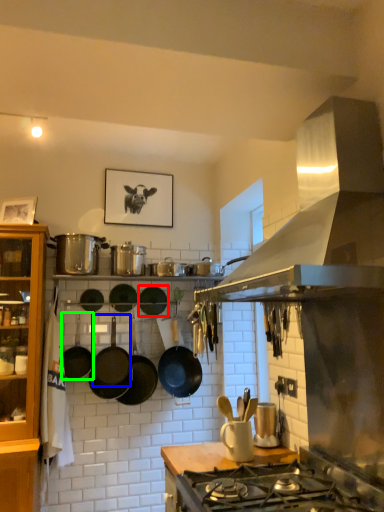
Question: Which object is positioned closest to wok (highlighted by a red box)? Select from wok (highlighted by a blue box) and wok (highlighted by a green box).

Choices:
 (A) wok
 (B) wok

Answer: (A)